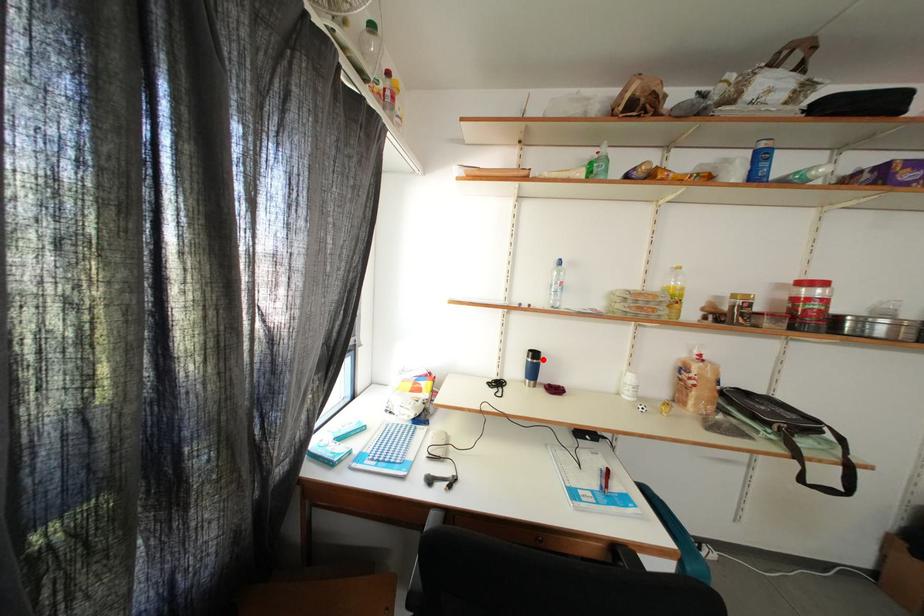
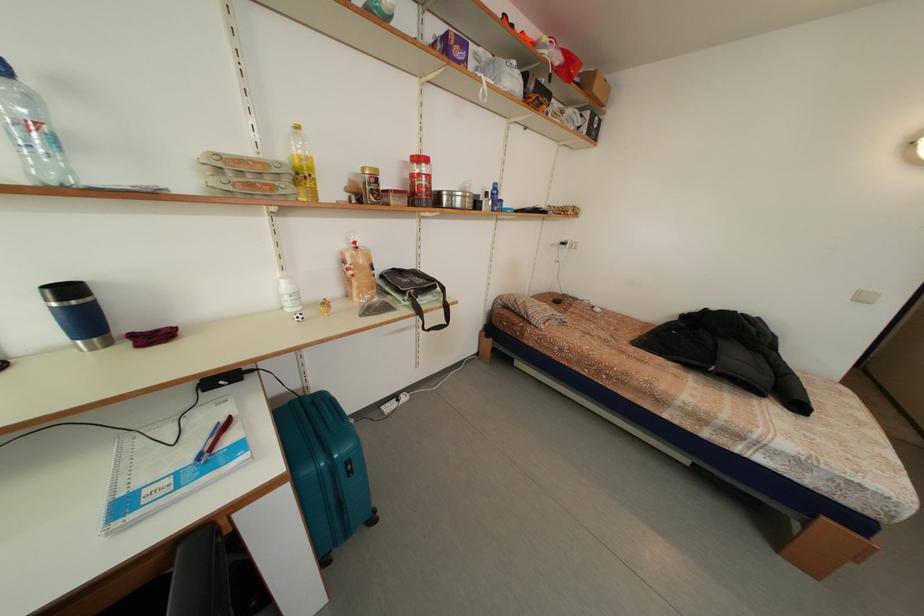
Where in the second image is the point corresponding to the highlighted location from the first image?

(78, 296)